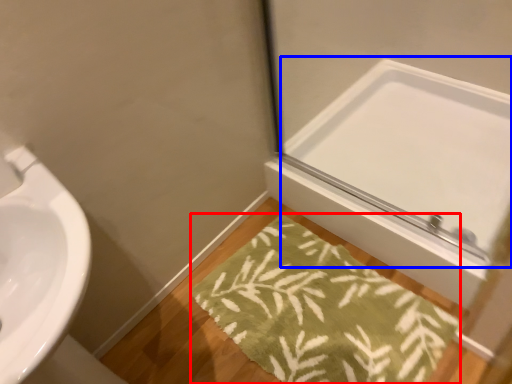
Question: Which object is closer to the camera taking this photo, bath mat (highlighted by a red box) or mirror (highlighted by a blue box)?

Choices:
 (A) bath mat
 (B) mirror

Answer: (A)